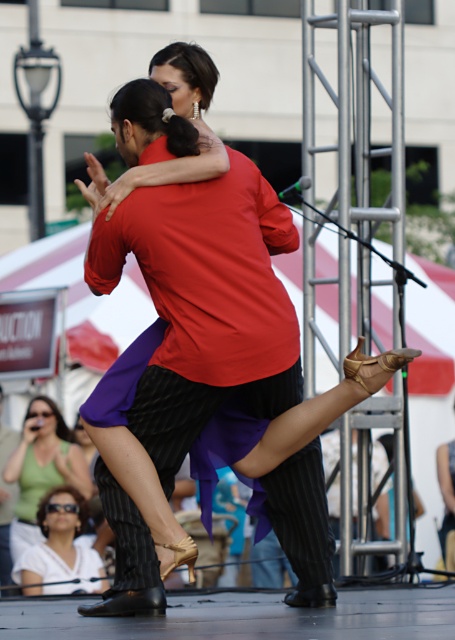
Which is in front, point (191, 124) or point (39, 480)?

Point (191, 124)

Identify the location of matte red shirt at center. (187, 358).

In order to click on matte red shirt at center in this screenshot , I will do pyautogui.click(x=187, y=358).

Is point (61, 419) positioned before point (35, 572)?

No, (61, 419) is behind (35, 572).

Describe the element at coordinates (41, 468) in the screenshot. I see `matte black dress at lower center` at that location.

Find the location of `matte black dress at lower center`. matte black dress at lower center is located at coordinates (41, 468).

Can you confirm if matte red shirt at center is positioned to the right of white matte sunglasses at lower left?

Correct, you'll find matte red shirt at center to the right of white matte sunglasses at lower left.

The height and width of the screenshot is (640, 455). Describe the element at coordinates (187, 358) in the screenshot. I see `matte red shirt at center` at that location.

Between point (182, 61) and point (71, 532), which one is positioned in front?

Positioned in front is point (182, 61).

The height and width of the screenshot is (640, 455). I want to click on matte red shirt at center, so click(187, 358).